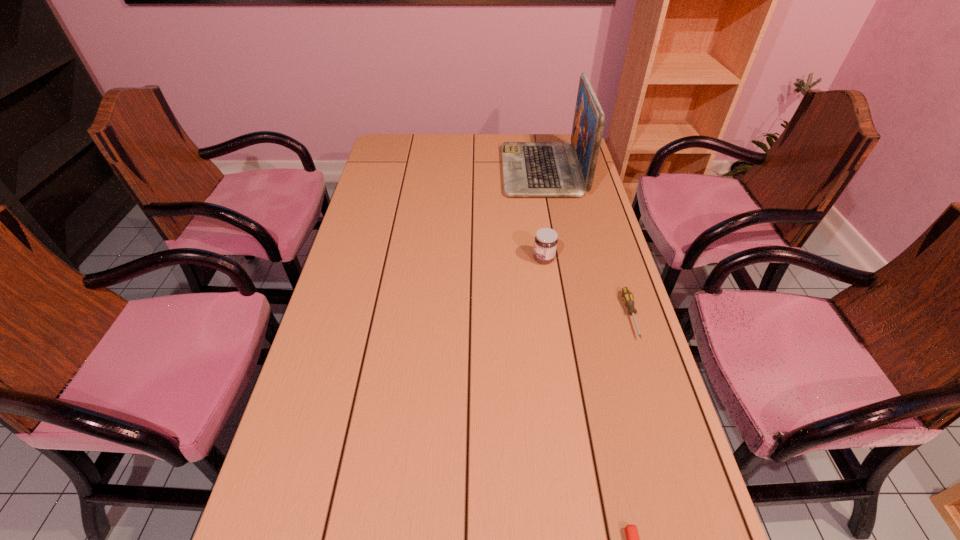
The height and width of the screenshot is (540, 960). Identify the location of free location located on the front label of the third shortest object. (423, 259).

Find the location of a particular element. The image size is (960, 540). free region located 0.060m on the front label of the third shortest object is located at coordinates (513, 259).

Where is `blank space located at the tip of the third tallest object`? Image resolution: width=960 pixels, height=540 pixels. blank space located at the tip of the third tallest object is located at coordinates 669,437.

I want to click on object that is at the far edge, so click(x=530, y=169).

Locate an element on the screen. This screenshot has height=540, width=960. laptop computer at the right edge is located at coordinates (530, 169).

Identify the location of screwdriver present at the right edge. The width and height of the screenshot is (960, 540). (627, 296).

The image size is (960, 540). I want to click on object located at the far right corner, so click(530, 169).

The width and height of the screenshot is (960, 540). In the image, there is a desktop. In order to click on vacant space at the far edge in this screenshot , I will do `click(427, 154)`.

Where is `vacant space at the left edge of the desktop`? The width and height of the screenshot is (960, 540). vacant space at the left edge of the desktop is located at coordinates (383, 177).

In the image, there is a desktop. Where is `vacant area at the right edge`? vacant area at the right edge is located at coordinates (652, 368).